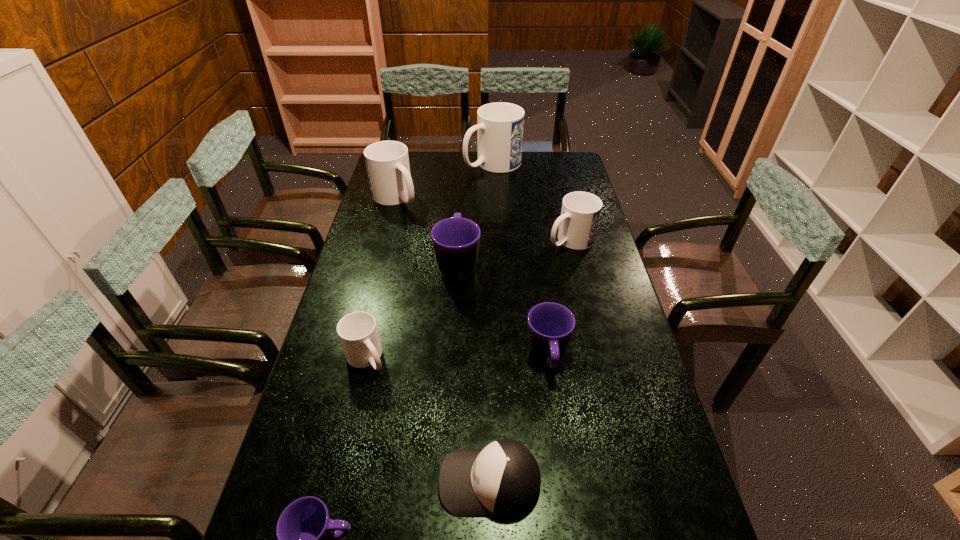
Where is `free space between the smallest blue mug and the second smallest black mug`? Image resolution: width=960 pixels, height=540 pixels. free space between the smallest blue mug and the second smallest black mug is located at coordinates (457, 357).

The width and height of the screenshot is (960, 540). In order to click on free space between the third blue mug from left to right and the second biggest black mug in this screenshot , I will do coord(520,261).

The height and width of the screenshot is (540, 960). What are the coordinates of `empty space that is in between the second smallest black mug and the seventh nearest object` in the screenshot? It's located at (471, 278).

Image resolution: width=960 pixels, height=540 pixels. What are the coordinates of `free space between the gray cap and the second smallest blue mug` in the screenshot? It's located at (530, 361).

The image size is (960, 540). What are the coordinates of `vacant area that lies between the second farthest object and the rightmost black mug` in the screenshot? It's located at (471, 278).

This screenshot has width=960, height=540. I want to click on vacant area between the rightmost black mug and the tallest object, so click(520, 261).

Image resolution: width=960 pixels, height=540 pixels. Identify the location of object that can be found as the seventh closest to the farthest black mug. (305, 532).

Locate an element on the screen. Image resolution: width=960 pixels, height=540 pixels. object that is the second closest to the second biggest blue mug is located at coordinates (455, 241).

Identify which mug is located as the nearest to the second biggest blue mug. Please provide its 2D coordinates. Your answer should be formatted as a tuple, i.e. [(x, y)], where the tuple contains the x and y coordinates of a point satisfying the conditions above.

[(500, 125)]

Identify which mug is the closest to the smallest black mug. Please provide its 2D coordinates. Your answer should be formatted as a tuple, i.e. [(x, y)], where the tuple contains the x and y coordinates of a point satisfying the conditions above.

[(357, 331)]